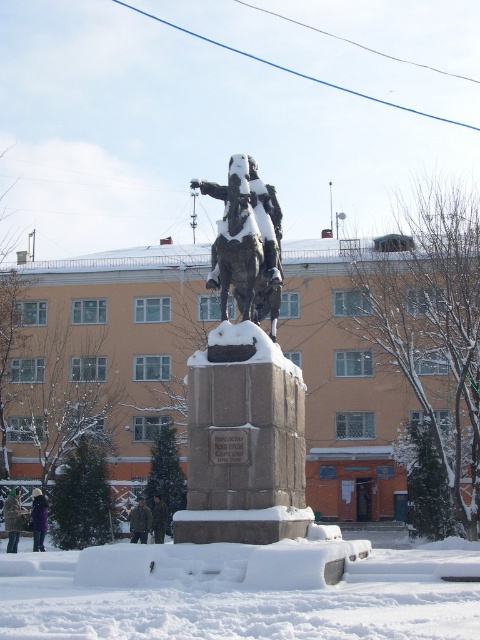
Which of these two, bronze statue at center or purple fuzzy jacket at lower left, stands shorter?

purple fuzzy jacket at lower left is shorter.

Between point (223, 337) and point (36, 522), which one is positioned in front?

Point (223, 337) is in front.

Where is `bronze statue at center`? bronze statue at center is located at coordinates (244, 388).

Can you confirm if bronze statue at center is taller than camouflage uniform at center?

Yes.

The width and height of the screenshot is (480, 640). Describe the element at coordinates (244, 388) in the screenshot. I see `bronze statue at center` at that location.

You are a GUI agent. You are given a task and a screenshot of the screen. Output one action in this format:
    pyautogui.click(x=<x>, y=<y>)
    Task: Click on the bronze statue at center
    
    Given the screenshot: What is the action you would take?
    [x=244, y=388]

Measure the distance between point (19,506) and camera.

They are 99.44 meters apart.

Can you confirm if dark green fur coat at lower left is positioned below camouflage uniform at center?

Indeed, dark green fur coat at lower left is positioned under camouflage uniform at center.

Find the location of a particular element. This screenshot has height=640, width=480. dark green fur coat at lower left is located at coordinates (12, 518).

I want to click on dark green fur coat at lower left, so click(12, 518).